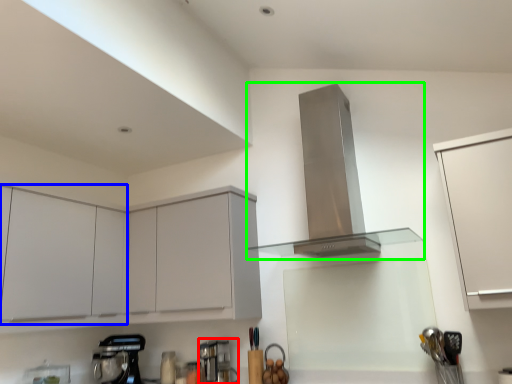
Question: Estimate the real-world distances between objects in this image. Which object is farther from coffee machine (highlighted by a red box), cabinetry (highlighted by a blue box) or home appliance (highlighted by a green box)?

Choices:
 (A) cabinetry
 (B) home appliance

Answer: (B)